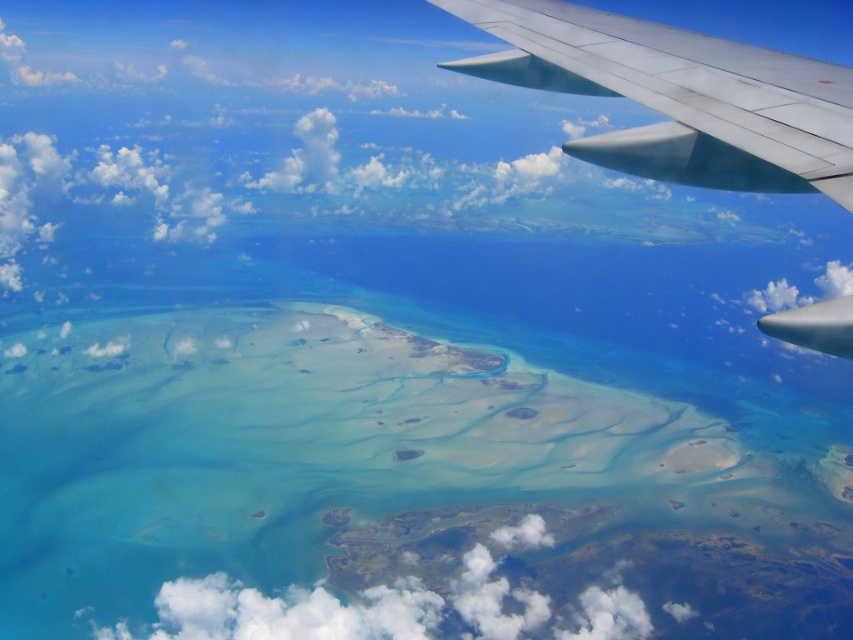
Question: Which object appears closest to the camera in this image?

Choices:
 (A) metallic silver wing at upper right
 (B) white fluffy cloud at center
 (C) translucent sandbar at center

Answer: (A)

Question: Which of the following is the farthest from the observer?

Choices:
 (A) white fluffy cloud at center
 (B) translucent sandbar at center
 (C) metallic silver wing at upper right

Answer: (B)

Question: Does translucent sandbar at center have a lesser width compared to white fluffy cloud at center?

Choices:
 (A) no
 (B) yes

Answer: (A)

Question: Which point appears closest to the camera in this image?

Choices:
 (A) (260, 440)
 (B) (368, 584)
 (C) (764, 106)

Answer: (C)

Question: Is metallic silver wing at upper right wider than white fluffy cloud at center?

Choices:
 (A) yes
 (B) no

Answer: (B)

Question: Is metallic silver wing at upper right thinner than white fluffy cloud at center?

Choices:
 (A) no
 (B) yes

Answer: (B)